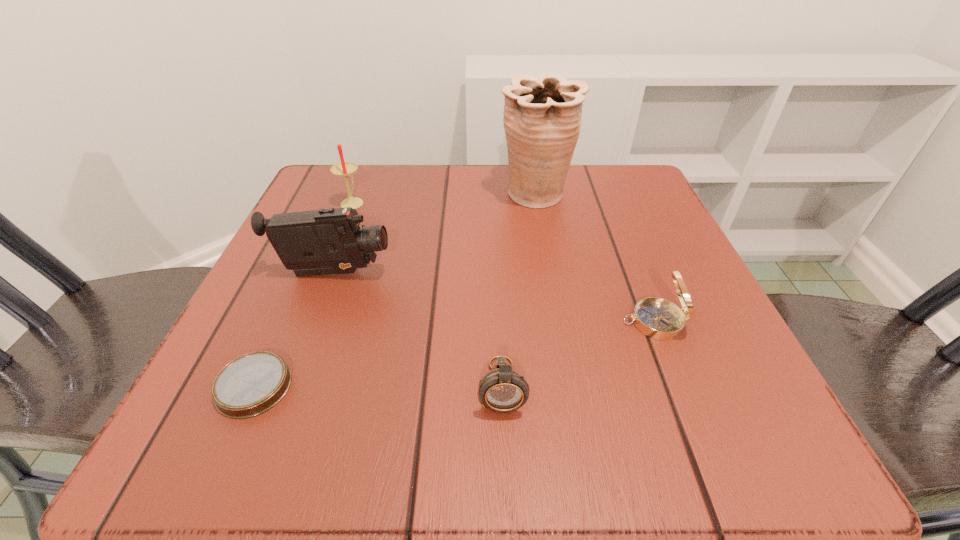
At what (x,y) coordinates should I click in order to perform the action: click on compass that is at the left edge. Please return your answer as a coordinate pair (x, y). Looking at the image, I should click on (250, 385).

Where is `object that is positioned at the right edge`? object that is positioned at the right edge is located at coordinates (658, 318).

Locate an element on the screen. Image resolution: width=960 pixels, height=540 pixels. object present at the far left corner is located at coordinates (345, 169).

Where is `object present at the near left corner`? The height and width of the screenshot is (540, 960). object present at the near left corner is located at coordinates (250, 385).

This screenshot has width=960, height=540. I want to click on vacant space at the far edge, so tap(454, 166).

I want to click on vacant region at the near edge of the desktop, so click(x=492, y=458).

At what (x,y) coordinates should I click in order to perform the action: click on free space at the left edge of the desktop. Please return your answer as a coordinate pair (x, y). Looking at the image, I should click on (335, 306).

The height and width of the screenshot is (540, 960). Identify the location of vacant area at the right edge. (694, 394).

Identify the location of free space at the near left corner of the desktop. This screenshot has width=960, height=540. (218, 431).

This screenshot has width=960, height=540. In order to click on vacant space at the far right corner of the desktop in this screenshot , I will do `click(571, 168)`.